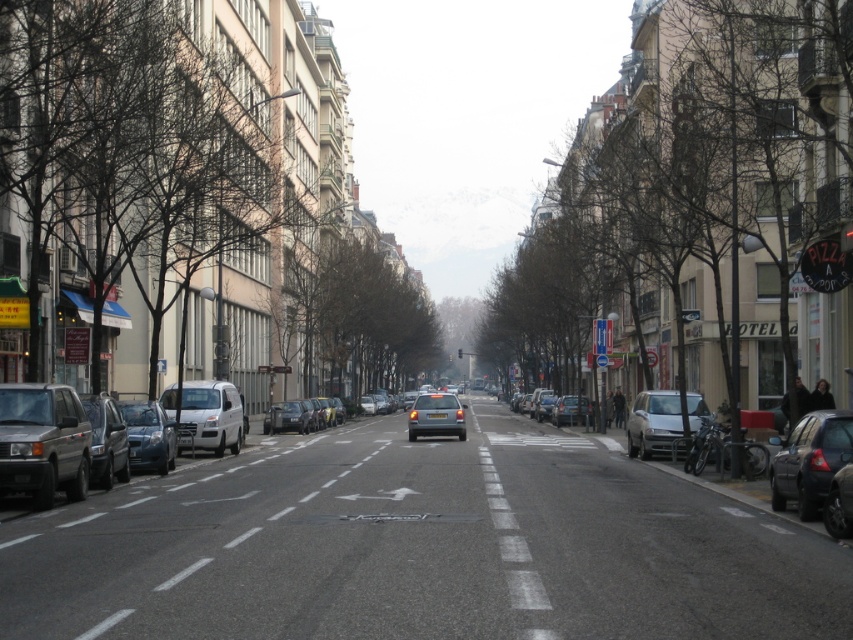
Where is `dark gray matte car at right`? This screenshot has height=640, width=853. dark gray matte car at right is located at coordinates (809, 460).

Does dark gray matte car at right have a lesser height compared to silver metallic car at center?

Yes.

Measure the distance between point (799, 445) and camera.

The distance of point (799, 445) from camera is 13.14 meters.

You are a GUI agent. You are given a task and a screenshot of the screen. Output one action in this format:
    pyautogui.click(x=<x>, y=<y>)
    Task: Click on the dark gray matte car at right
    The height and width of the screenshot is (640, 853).
    Given the screenshot: What is the action you would take?
    pyautogui.click(x=809, y=460)

Is matte black car at left below matte silver car at center?

Incorrect, matte black car at left is not positioned below matte silver car at center.

Who is more distant from viewer, (x=170, y=456) or (x=566, y=404)?

Positioned behind is point (x=566, y=404).

Identify the location of matte black car at left. This screenshot has height=640, width=853. (148, 435).

This screenshot has width=853, height=640. What are the coordinates of `matte black car at left` in the screenshot? It's located at (148, 435).

Is silver metallic car at center positioned before silver metallic van at center-left?

Yes, silver metallic car at center is in front of silver metallic van at center-left.

This screenshot has height=640, width=853. Identify the location of silver metallic car at center. (436, 417).